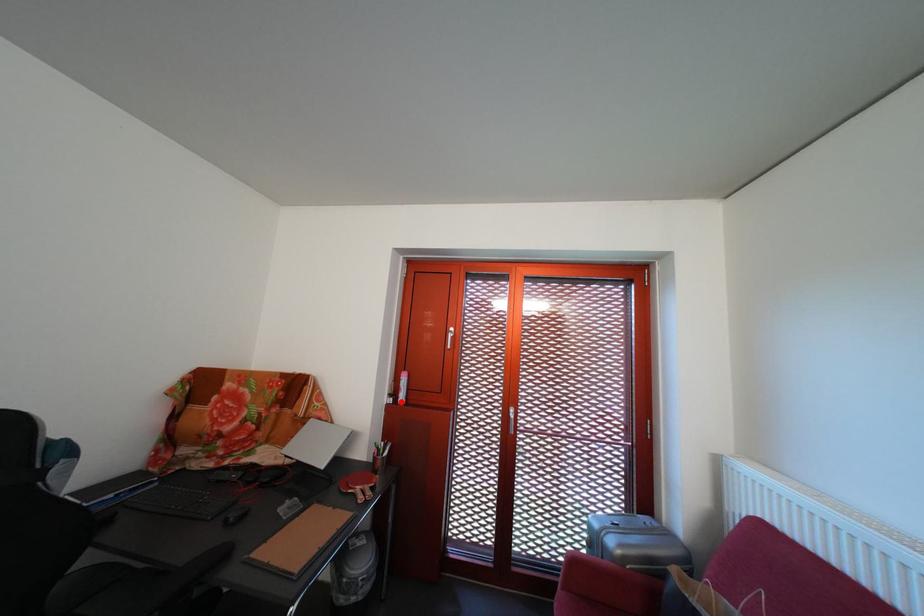
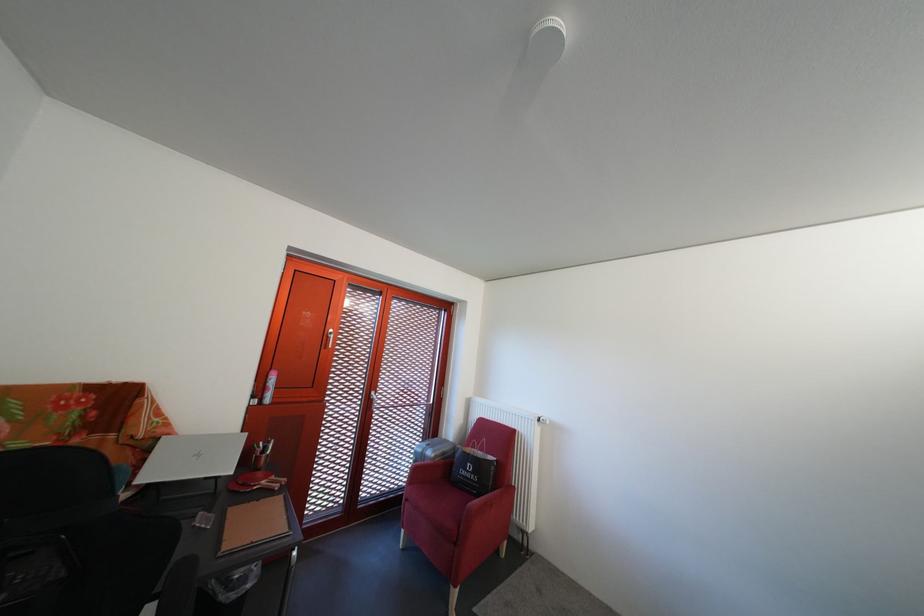
Find the pixel in the second image that matches the highlighted location in the first image.

(263, 403)